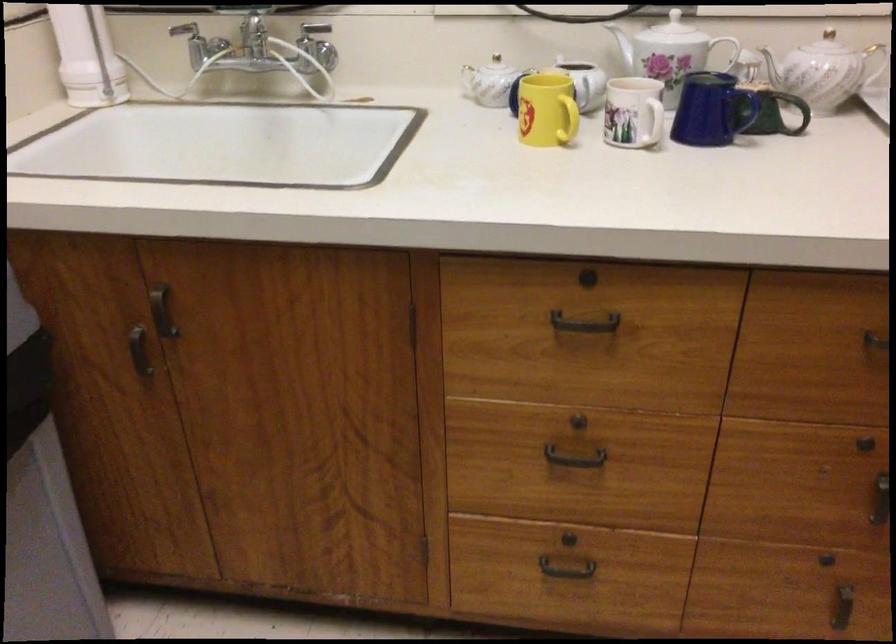
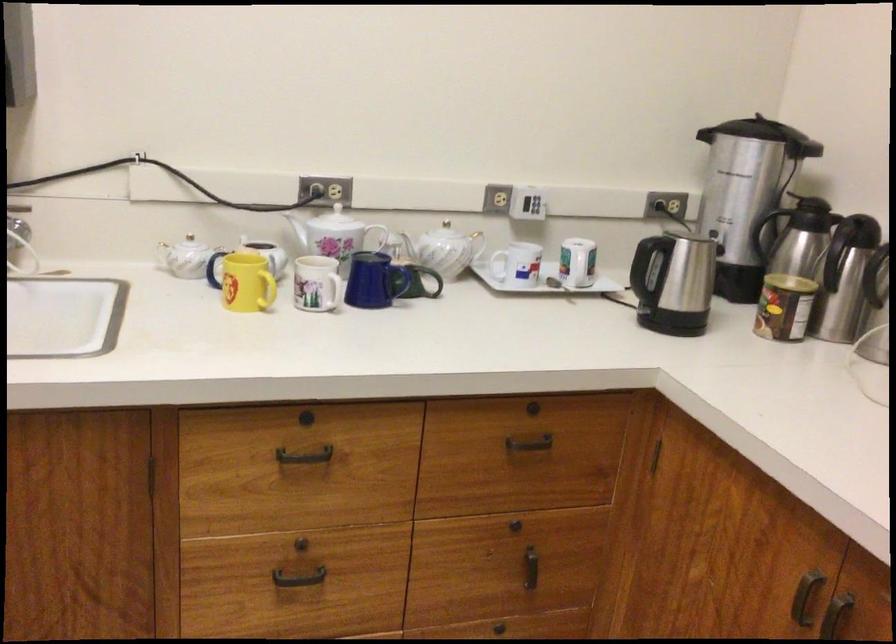
In the second image, find the point that corresponds to point (581, 324) in the first image.

(305, 456)